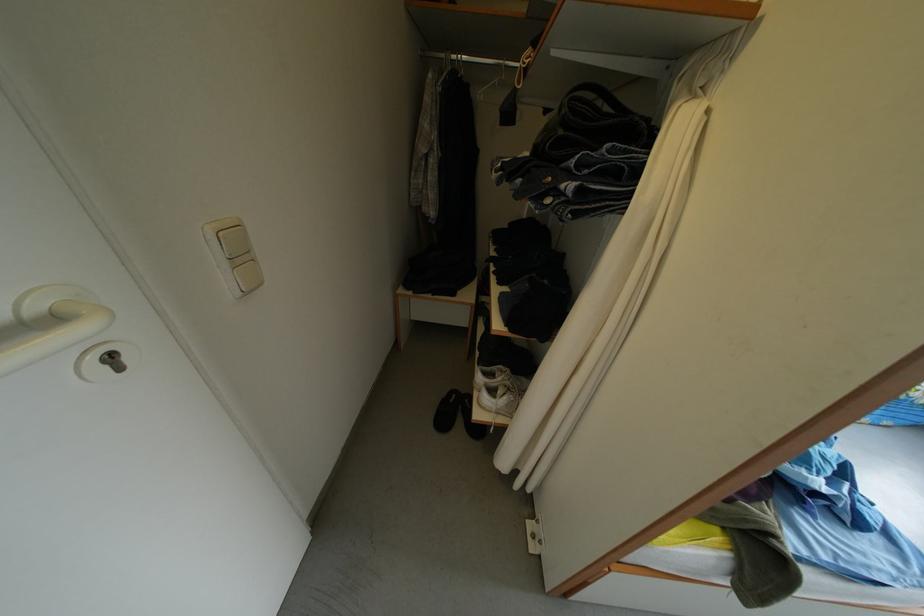
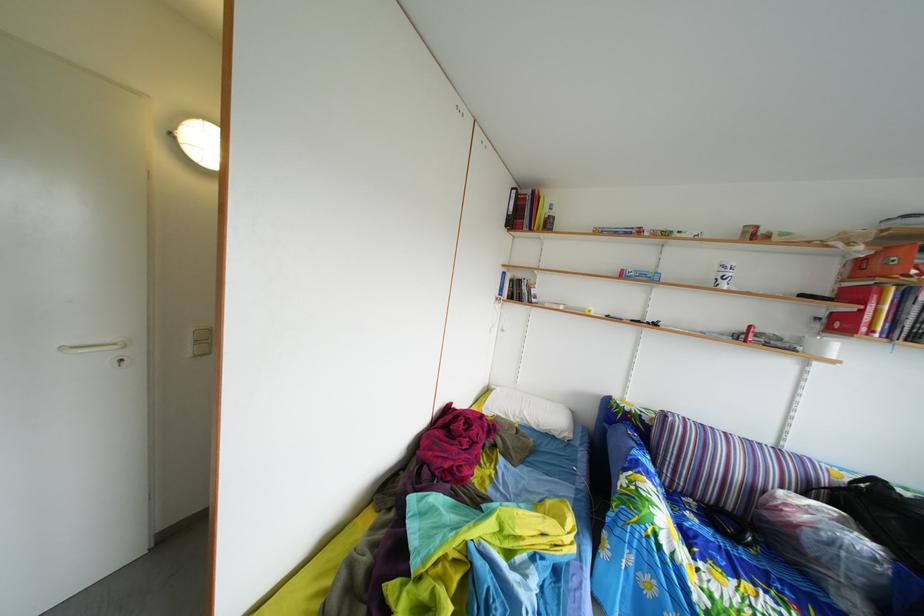
Question: I am providing you with two images of the same scene from different viewpoints. After the viewpoint changes to image2, which objects are now occluded?

Choices:
 (A) white sneaker
 (B) wardrobe door knob
 (C) light switch
 (D) white door handle

Answer: (A)